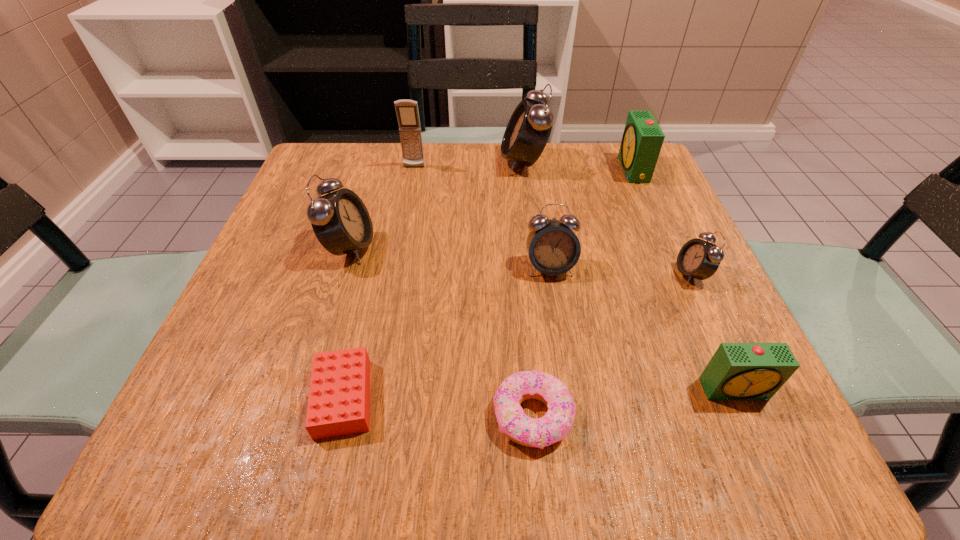
Where is `the eighth closest object to the third biggest white alarm clock`? This screenshot has height=540, width=960. the eighth closest object to the third biggest white alarm clock is located at coordinates (407, 112).

This screenshot has width=960, height=540. In order to click on the second closest alarm clock relative to the fifth shortest alarm clock in this screenshot , I will do `click(528, 130)`.

Locate which alarm clock ranks second in proximity to the smaller green alarm clock. Please provide its 2D coordinates. Your answer should be formatted as a tuple, i.e. [(x, y)], where the tuple contains the x and y coordinates of a point satisfying the conditions above.

[(553, 248)]

What are the coordinates of `white alarm clock identified as the second closest to the rightmost white alarm clock` in the screenshot? It's located at (528, 130).

Identify the location of white alarm clock that is the third closest to the smaller green alarm clock. (528, 130).

The width and height of the screenshot is (960, 540). I want to click on vacant area in the image that satisfies the following two spatial constraints: 1. on the face of the rightmost white alarm clock; 2. on the front side of the Lego, so click(x=749, y=398).

At what (x,y) coordinates should I click in order to perform the action: click on free space that satisfies the following two spatial constraints: 1. on the face of the fifth shortest alarm clock; 2. on the left side of the Lego. Please return your answer as a coordinate pair (x, y). The height and width of the screenshot is (540, 960). Looking at the image, I should click on (304, 398).

Locate an element on the screen. The height and width of the screenshot is (540, 960). vacant area that satisfies the following two spatial constraints: 1. on the face of the fifth shortest alarm clock; 2. on the left side of the pink doughnut is located at coordinates (299, 416).

I want to click on free space that satisfies the following two spatial constraints: 1. on the back side of the Lego; 2. on the face of the leftmost alarm clock, so click(x=379, y=247).